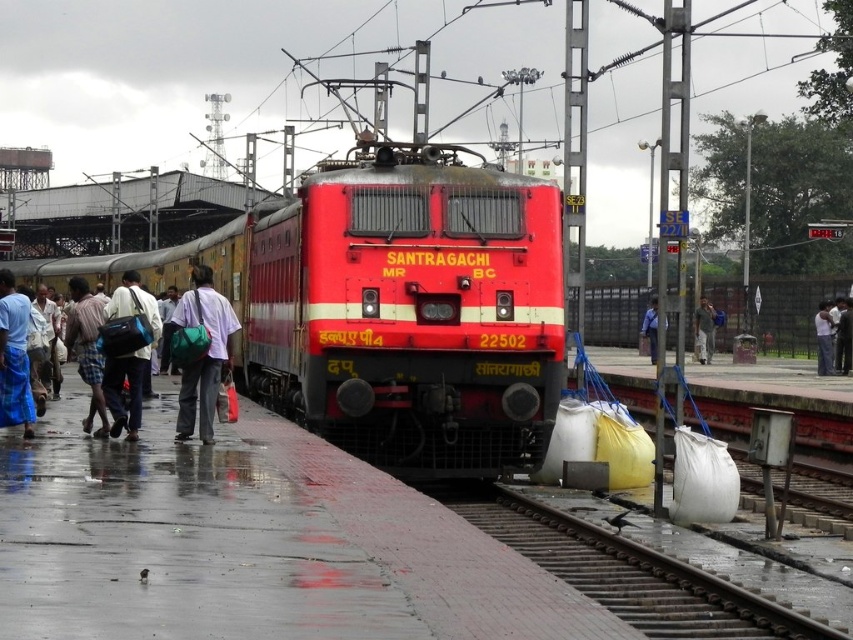
Question: Which object is positioned closest to the light blue fabric pants at left?

Choices:
 (A) metal train track at lower center
 (B) blue fabric bag at left
 (C) blue shirt at center
 (D) matte green bag at center

Answer: (B)

Question: Is matte green bag at center positioned behind light gray pants at center?

Choices:
 (A) yes
 (B) no

Answer: (B)

Question: Does red glossy train at center appear on the left side of white fabric shirt at center?

Choices:
 (A) yes
 (B) no

Answer: (A)

Question: Is light blue fabric pants at left smaller than matte green bag at center?

Choices:
 (A) no
 (B) yes

Answer: (A)

Question: Which point is closer to the camera taking this photo?

Choices:
 (A) (824, 312)
 (B) (650, 362)
 (C) (714, 324)
 (D) (515, 525)

Answer: (D)

Question: Among these points, which one is nearest to the camera?

Choices:
 (A) (105, 426)
 (B) (148, 388)
 (C) (618, 602)
 (D) (206, 403)

Answer: (C)